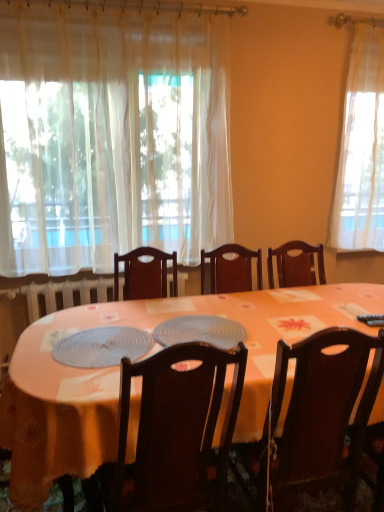
The height and width of the screenshot is (512, 384). In order to click on vacant space underneath translucent plastic platter at center, which is the second platter from right to left (from a real-world perspective) in this screenshot , I will do `click(105, 344)`.